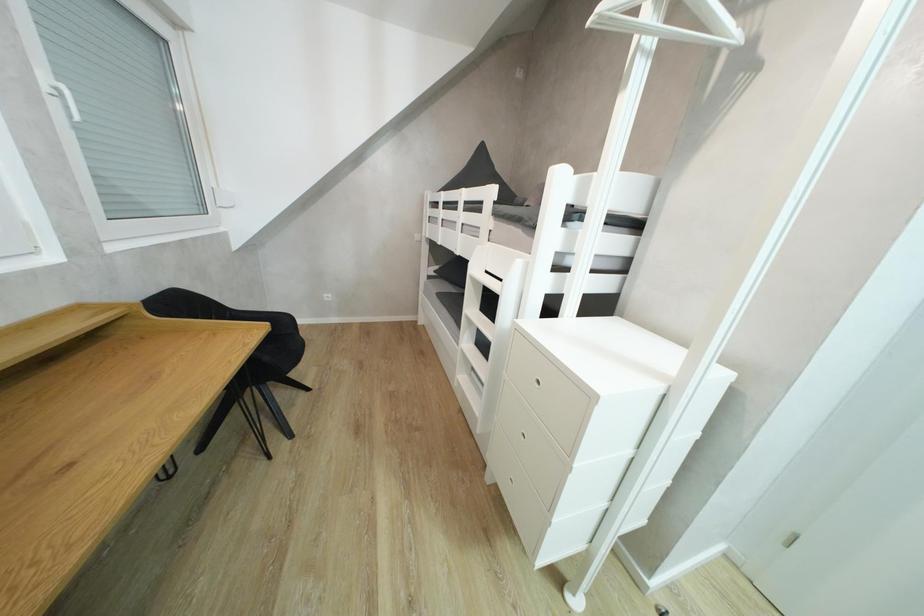
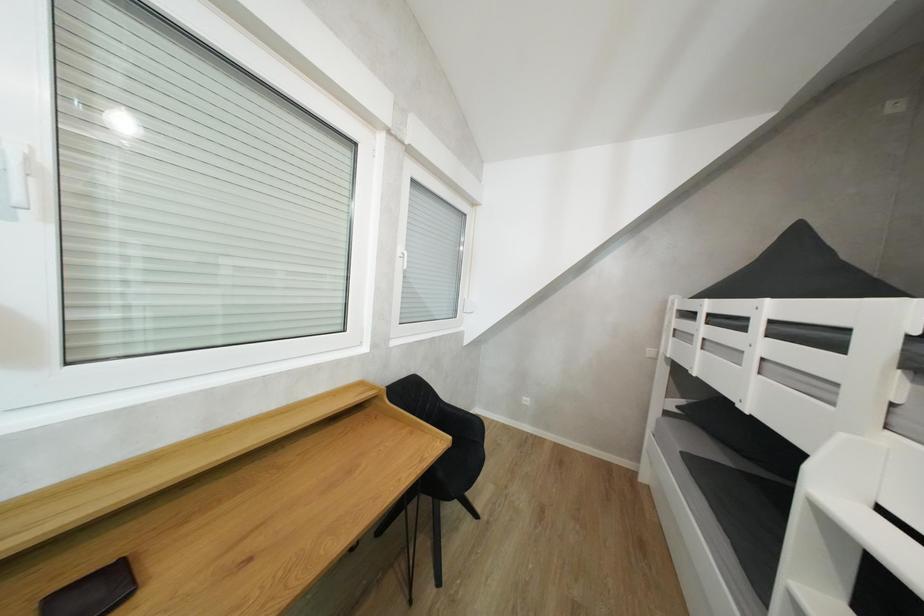
Question: The first image is from the beginning of the video and the second image is from the end. How did the camera likely rotate when shooting the video?

Choices:
 (A) Left
 (B) Right
 (C) Up
 (D) Down

Answer: (A)